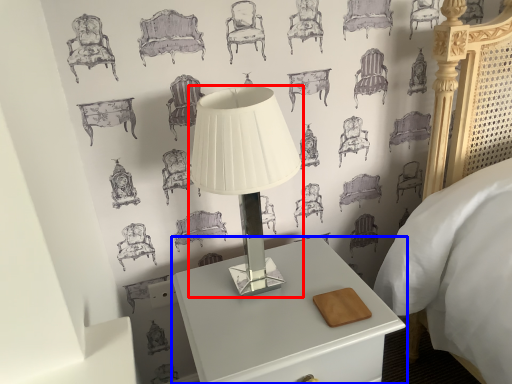
Question: Which object is further to the camera taking this photo, lamp (highlighted by a red box) or nightstand (highlighted by a blue box)?

Choices:
 (A) lamp
 (B) nightstand

Answer: (B)